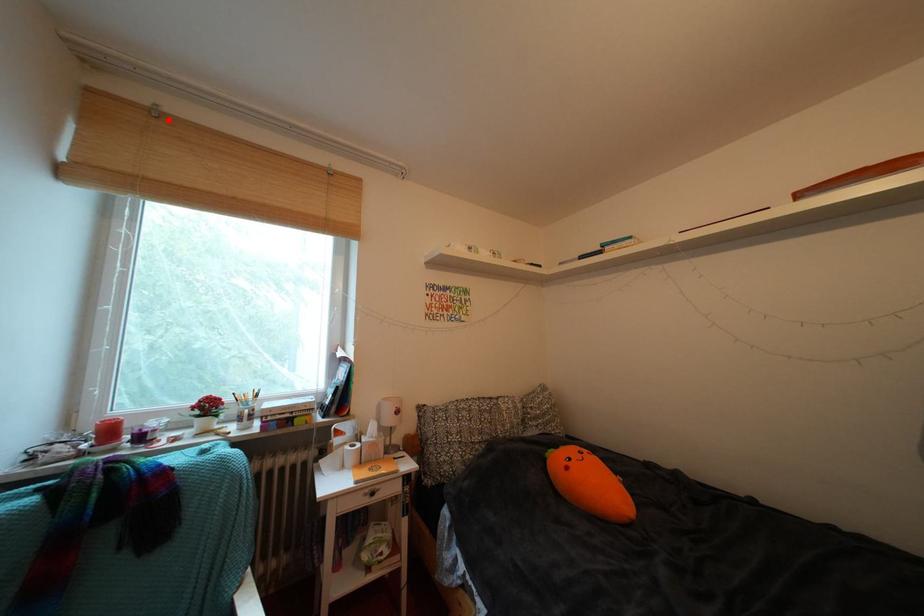
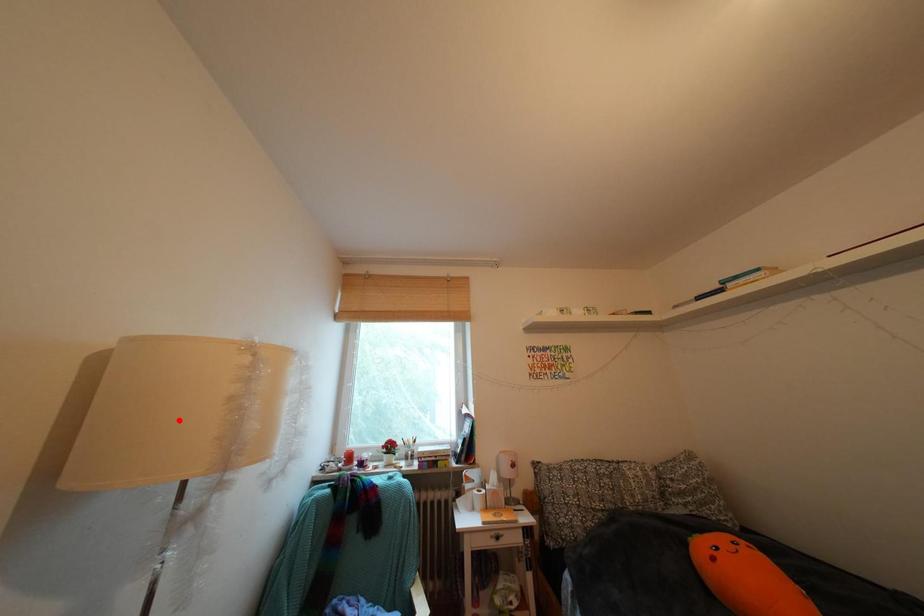
I am providing you with two images of the same scene from different viewpoints. A red point is marked on the first image and another point is marked on the second image. Does the point marked in image1 correspond to the same location as the one in image2?

No